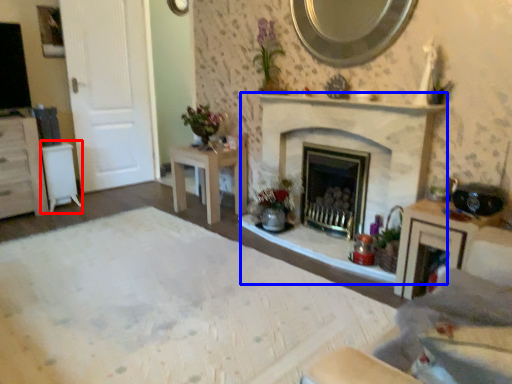
Question: Which object appears closest to the camera in this image, table (highlighted by a red box) or fireplace (highlighted by a blue box)?

Choices:
 (A) table
 (B) fireplace

Answer: (B)